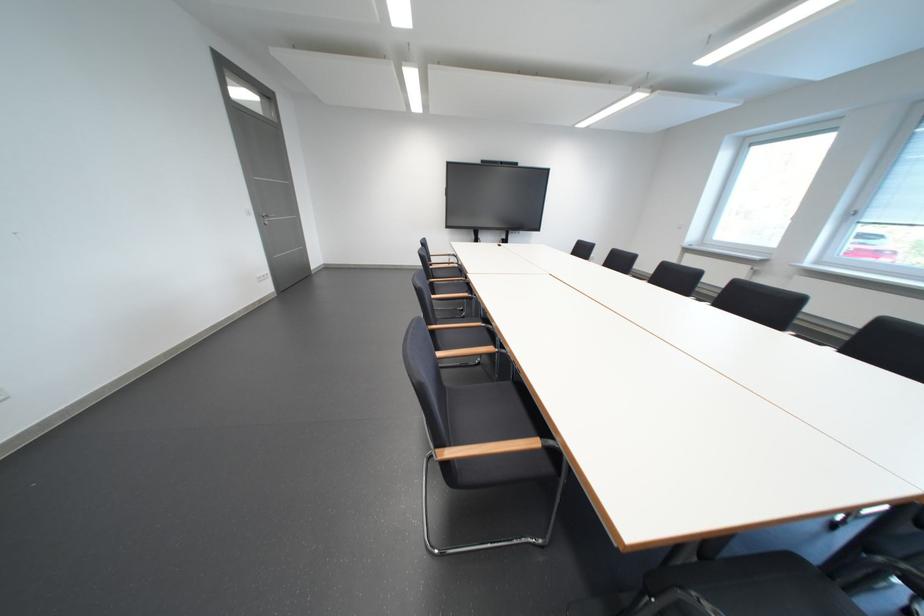
Describe the element at coordinates (490, 413) in the screenshot. I see `the black chair sitting surface` at that location.